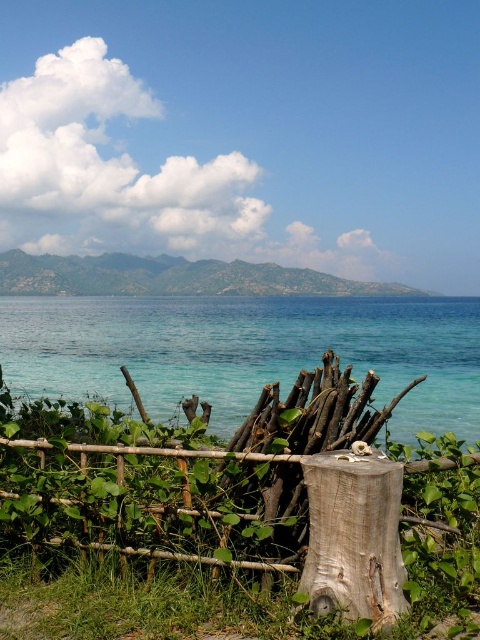
You are a painter standing at the edge of the scene, wanting to paint the clear blue water at lower center and the light brown wood stump at center. Which object should you paint first if you want to follow the natural order from foreground to background?

The light brown wood stump at center should be painted first because it is located below the clear blue water at lower center, making it part of the foreground.

You are standing at the edge of the coastal scene and want to place a small decorative rock on the light brown wood stump at center. However, you can only reach objects that are in front of the clear blue water at lower center. Can you place the rock on the stump?

The light brown wood stump at center is behind the clear blue water at lower center, so you cannot place the rock on the stump because it is not in front of the water.